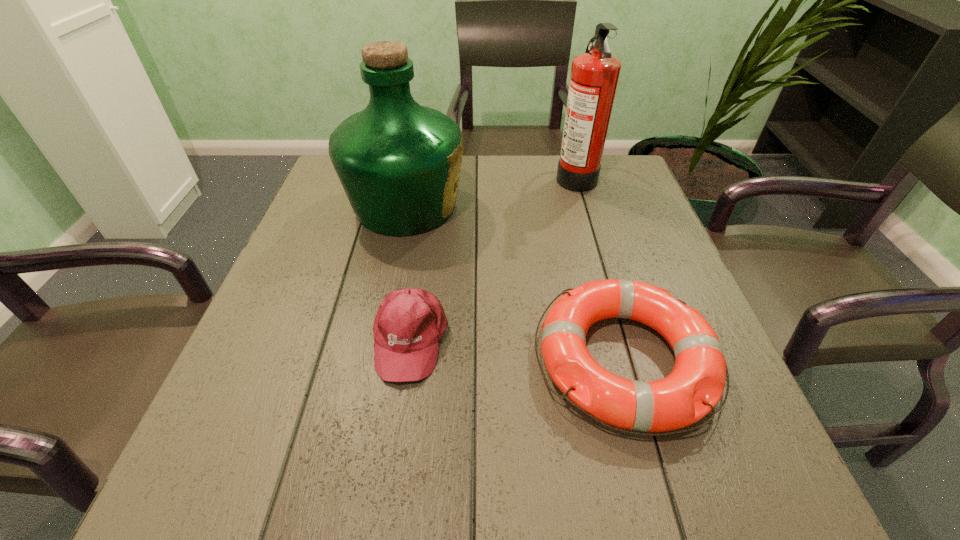
The image size is (960, 540). Identify the location of free spot between the baseball cap and the life buoy. (518, 349).

Locate an element on the screen. The width and height of the screenshot is (960, 540). blank region between the shortest object and the baseball cap is located at coordinates (518, 349).

Locate which object ranks in proximity to the fire extinguisher. Please provide its 2D coordinates. Your answer should be formatted as a tuple, i.e. [(x, y)], where the tuple contains the x and y coordinates of a point satisfying the conditions above.

[(399, 163)]

This screenshot has height=540, width=960. Find the location of `object that is the closest to the shortest object`. object that is the closest to the shortest object is located at coordinates (409, 323).

The height and width of the screenshot is (540, 960). I want to click on free region that satisfies the following two spatial constraints: 1. on the label side of the liquor; 2. on the right side of the shortest object, so click(373, 360).

At what (x,y) coordinates should I click in order to perform the action: click on free space that satisfies the following two spatial constraints: 1. on the label side of the shortest object; 2. on the right side of the liquor. Please return your answer as a coordinate pair (x, y). The image size is (960, 540). Looking at the image, I should click on (373, 360).

The height and width of the screenshot is (540, 960). I want to click on blank space that satisfies the following two spatial constraints: 1. on the front-facing side of the fire extinguisher; 2. at the front of the baseball cap with the brim, so click(x=623, y=339).

The width and height of the screenshot is (960, 540). Find the location of `free spot that satisfies the following two spatial constraints: 1. at the front of the baseball cap with the brim; 2. on the left side of the life buoy`. free spot that satisfies the following two spatial constraints: 1. at the front of the baseball cap with the brim; 2. on the left side of the life buoy is located at coordinates (408, 360).

Where is `vacant region that satisfies the following two spatial constraints: 1. at the front of the baseball cap with the brim; 2. on the left side of the life buoy`? vacant region that satisfies the following two spatial constraints: 1. at the front of the baseball cap with the brim; 2. on the left side of the life buoy is located at coordinates (408, 360).

This screenshot has width=960, height=540. What are the coordinates of `vacant area that satisfies the following two spatial constraints: 1. at the front of the shortest object with the brim; 2. on the right side of the baseball cap` in the screenshot? It's located at click(408, 360).